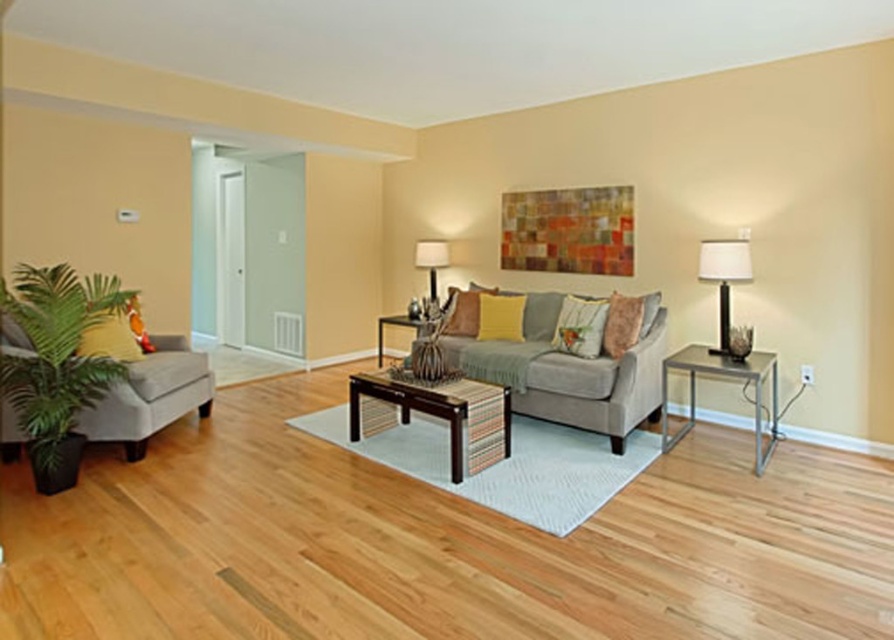
Looking at this image, is gray fabric couch at center above wooden coffee table at center?

Incorrect, gray fabric couch at center is not positioned above wooden coffee table at center.

Between gray fabric couch at center and wooden coffee table at center, which one is positioned lower?

gray fabric couch at center

The width and height of the screenshot is (894, 640). Identify the location of gray fabric couch at center. (570, 371).

Between dark brown wood coffee table at center and metallic silver side table at right, which one is positioned lower?

dark brown wood coffee table at center is lower down.

The height and width of the screenshot is (640, 894). Describe the element at coordinates (441, 413) in the screenshot. I see `dark brown wood coffee table at center` at that location.

What do you see at coordinates (441, 413) in the screenshot? This screenshot has width=894, height=640. I see `dark brown wood coffee table at center` at bounding box center [441, 413].

What are the coordinates of `dark brown wood coffee table at center` in the screenshot? It's located at (441, 413).

Between white fabric lampshade at right and wooden coffee table at center, which one has more height?

white fabric lampshade at right is taller.

Between point (724, 280) and point (381, 360), which one is positioned in front?

Point (724, 280) is in front.

Locate an element on the screen. The width and height of the screenshot is (894, 640). white fabric lampshade at right is located at coordinates (724, 276).